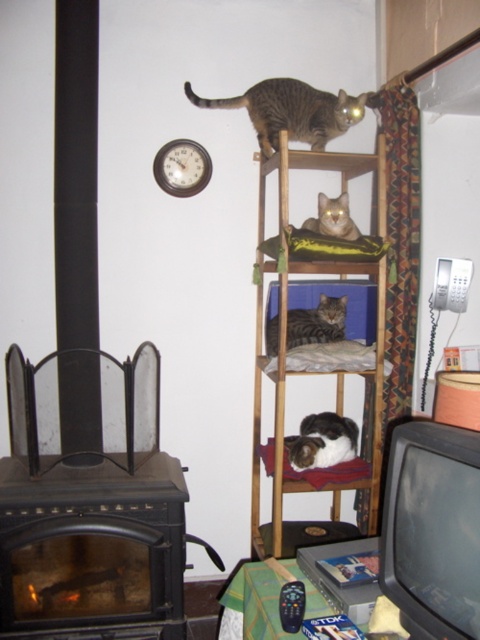
Question: Does fluffy white cat at center appear over tabby fur cat at center?

Choices:
 (A) yes
 (B) no

Answer: (B)

Question: Which of the following is the closest to the observer?

Choices:
 (A) tabby cat at upper center
 (B) fluffy white cat at center

Answer: (B)

Question: Which point is closer to the camera taking this photo?

Choices:
 (A) (324, 230)
 (B) (204, 180)

Answer: (A)

Question: Which object is the farthest from the soft fabric cat bed at center?

Choices:
 (A) tabby fur cat at center
 (B) tabby cat at upper center

Answer: (B)

Question: Is tabby cat at upper center to the right of tabby fur cat at center from the viewer's perspective?

Choices:
 (A) yes
 (B) no

Answer: (B)

Question: Is fluffy white cat at center above tabby fur cat at center?

Choices:
 (A) yes
 (B) no

Answer: (B)